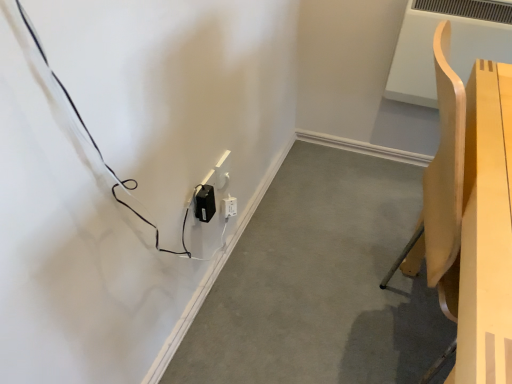
Question: Is light wood chair at right wider or thinner than black plastic power adapter at lower left?

Choices:
 (A) thin
 (B) wide

Answer: (A)

Question: In terms of size, does light wood chair at right appear bigger or smaller than black plastic power adapter at lower left?

Choices:
 (A) big
 (B) small

Answer: (A)

Question: Estimate the real-world distances between objects in this image. Which object is farther from the light wood chair at right?

Choices:
 (A) black plastic power adapter at lower center, the 1th electric outlet when ordered from front to back
 (B) black plastic power adapter at lower left
 (C) white plastic electric outlet at center, which is the 1th electric outlet in back-to-front order

Answer: (C)

Question: Based on their relative distances, which object is nearer to the black plastic power adapter at lower left?

Choices:
 (A) black plastic power adapter at lower center, the second electric outlet when ordered from back to front
 (B) white plastic electric outlet at center, arranged as the 2th electric outlet when viewed from the front
 (C) light wood chair at right

Answer: (B)